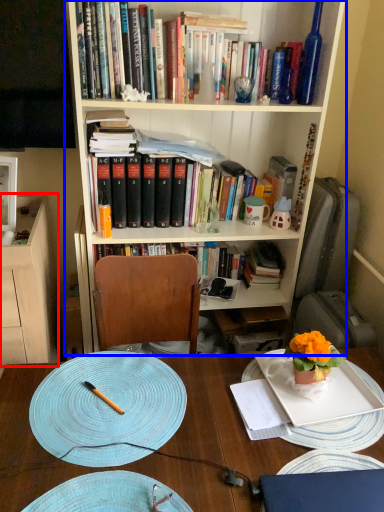
Question: Which of the following is the closest to the observer, cabinetry (highlighted by a red box) or bookcase (highlighted by a blue box)?

Choices:
 (A) cabinetry
 (B) bookcase

Answer: (B)